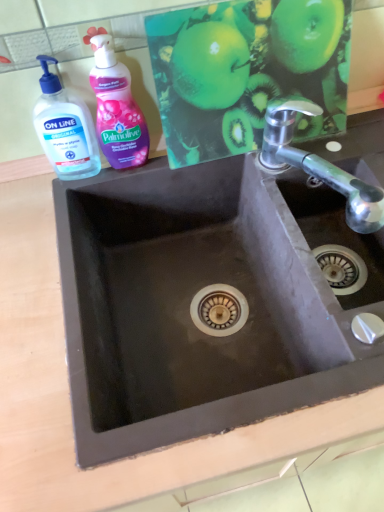
Locate an element on the screen. The image size is (384, 512). free space to the left of transparent plastic hand soap at upper left is located at coordinates (28, 185).